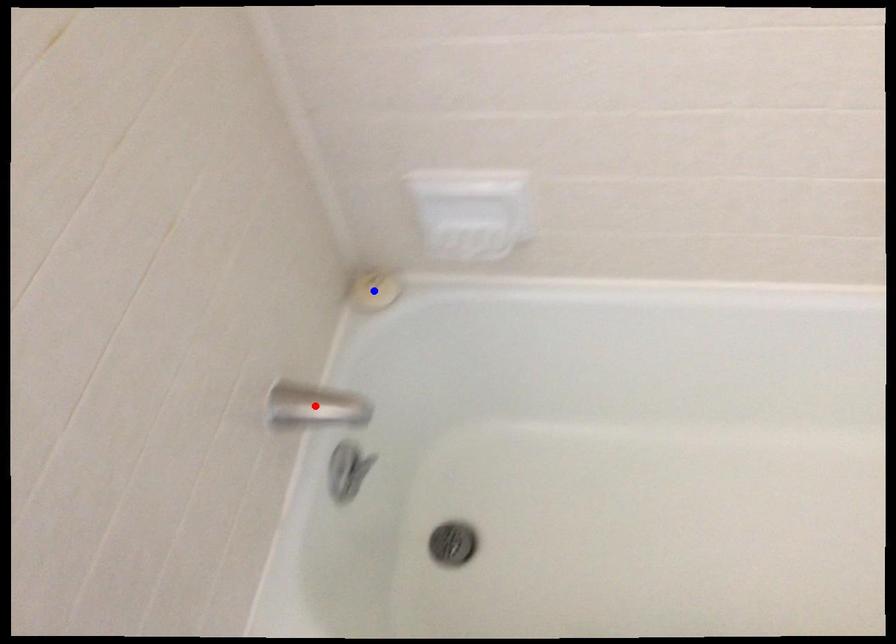
Question: In the image, two points are highlighted. Which point is nearer to the camera? Reply with the corresponding letter.

Choices:
 (A) blue point
 (B) red point

Answer: (B)